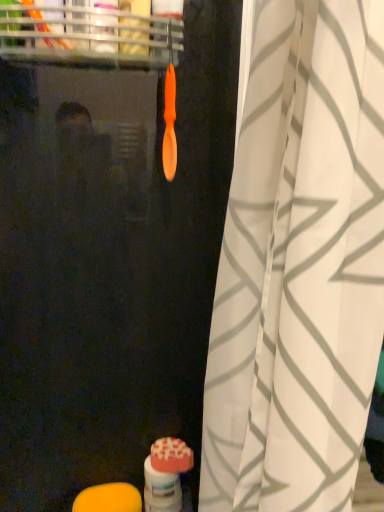
Question: Considering the relative positions of matte pink soap at lower center, the 1th soap viewed from the right, and white textured curtain at center in the image provided, is matte pink soap at lower center, the 1th soap viewed from the right, to the left of white textured curtain at center from the viewer's perspective?

Choices:
 (A) yes
 (B) no

Answer: (A)

Question: Does matte pink soap at lower center, acting as the second soap starting from the left, have a smaller size compared to white textured curtain at center?

Choices:
 (A) no
 (B) yes

Answer: (B)

Question: Considering the relative sizes of matte pink soap at lower center, acting as the second soap starting from the left, and white textured curtain at center in the image provided, is matte pink soap at lower center, acting as the second soap starting from the left, shorter than white textured curtain at center?

Choices:
 (A) no
 (B) yes

Answer: (B)

Question: From the image's perspective, would you say matte pink soap at lower center, which is counted as the 1th soap, starting from the top, is shown under white textured curtain at center?

Choices:
 (A) yes
 (B) no

Answer: (A)

Question: Is matte pink soap at lower center, which is counted as the 1th soap, starting from the top, facing away from white textured curtain at center?

Choices:
 (A) yes
 (B) no

Answer: (B)

Question: Would you say matte pink soap at lower center, the 1th soap viewed from the right, is inside or outside matte orange toothbrush at lower center?

Choices:
 (A) outside
 (B) inside

Answer: (A)

Question: Is point (150, 452) closer or farther from the camera than point (168, 462)?

Choices:
 (A) farther
 (B) closer

Answer: (A)

Question: From a real-world perspective, is matte pink soap at lower center, the second soap in the bottom-to-top sequence, positioned above or below matte orange toothbrush at lower center?

Choices:
 (A) above
 (B) below

Answer: (A)

Question: From the image's perspective, is matte pink soap at lower center, acting as the second soap starting from the left, positioned above or below matte orange toothbrush at lower center?

Choices:
 (A) below
 (B) above

Answer: (B)

Question: Considering their positions, is matte orange toothbrush at lower center located in front of or behind orange matte soap at lower left, which is the 2th soap in right-to-left order?

Choices:
 (A) behind
 (B) front

Answer: (A)

Question: Considering the positions of matte orange toothbrush at lower center and orange matte soap at lower left, which is the second soap from top to bottom, in the image, is matte orange toothbrush at lower center bigger or smaller than orange matte soap at lower left, which is the second soap from top to bottom,?

Choices:
 (A) small
 (B) big

Answer: (B)

Question: Is matte orange toothbrush at lower center situated inside orange matte soap at lower left, which is the second soap from top to bottom, or outside?

Choices:
 (A) inside
 (B) outside

Answer: (B)

Question: In terms of width, does matte orange toothbrush at lower center look wider or thinner when compared to orange matte soap at lower left, which is the 1th soap from bottom to top?

Choices:
 (A) thin
 (B) wide

Answer: (A)

Question: Would you say orange matte soap at lower left, which is the 1th soap from bottom to top, is to the left or to the right of matte orange toothbrush at lower center in the picture?

Choices:
 (A) left
 (B) right

Answer: (A)

Question: From a real-world perspective, relative to matte orange toothbrush at lower center, is orange matte soap at lower left, which is the 2th soap in right-to-left order, vertically above or below?

Choices:
 (A) above
 (B) below

Answer: (B)